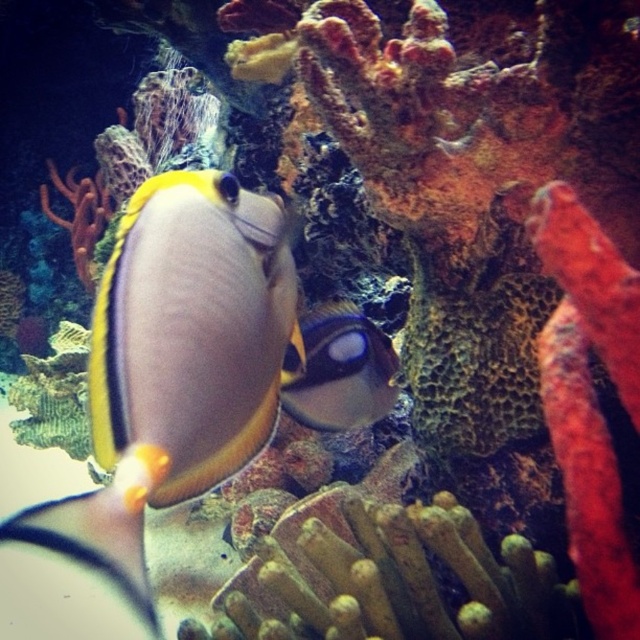
Question: Can you confirm if shiny yellow and black fish at center is wider than shiny blue and yellow fish at center?

Choices:
 (A) no
 (B) yes

Answer: (A)

Question: Is shiny yellow and black fish at center bigger than shiny blue and yellow fish at center?

Choices:
 (A) no
 (B) yes

Answer: (A)

Question: Which point is closer to the camera?

Choices:
 (A) (388, 406)
 (B) (246, 438)

Answer: (B)

Question: Which of the following is the closest to the observer?

Choices:
 (A) shiny yellow and black fish at center
 (B) shiny blue and yellow fish at center

Answer: (A)

Question: Does shiny yellow and black fish at center appear under shiny blue and yellow fish at center?

Choices:
 (A) yes
 (B) no

Answer: (B)

Question: Which point is closer to the camera?

Choices:
 (A) [362, 381]
 (B) [116, 292]

Answer: (B)